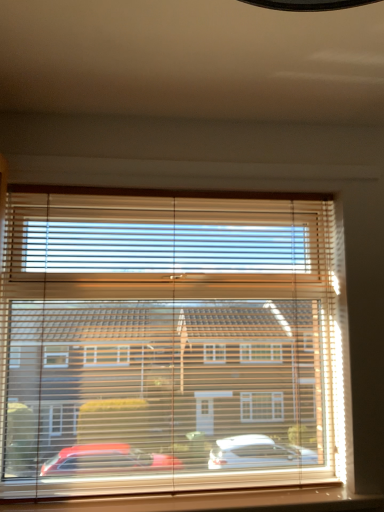
Question: From a real-world perspective, does wooden at lower center stand above wooden blinds at center?

Choices:
 (A) no
 (B) yes

Answer: (A)

Question: Is wooden at lower center oriented away from wooden blinds at center?

Choices:
 (A) yes
 (B) no

Answer: (A)

Question: Considering the relative positions of wooden at lower center and wooden blinds at center in the image provided, is wooden at lower center behind wooden blinds at center?

Choices:
 (A) yes
 (B) no

Answer: (B)

Question: Considering the relative sizes of wooden at lower center and wooden blinds at center in the image provided, is wooden at lower center taller than wooden blinds at center?

Choices:
 (A) no
 (B) yes

Answer: (A)

Question: Considering the relative sizes of wooden at lower center and wooden blinds at center in the image provided, is wooden at lower center wider than wooden blinds at center?

Choices:
 (A) no
 (B) yes

Answer: (B)

Question: From the image's perspective, is wooden at lower center below wooden blinds at center?

Choices:
 (A) yes
 (B) no

Answer: (A)

Question: Are wooden blinds at center and wooden at lower center making contact?

Choices:
 (A) yes
 (B) no

Answer: (B)

Question: Considering the relative sizes of wooden blinds at center and wooden at lower center in the image provided, is wooden blinds at center wider than wooden at lower center?

Choices:
 (A) yes
 (B) no

Answer: (B)

Question: Is wooden blinds at center positioned far away from wooden at lower center?

Choices:
 (A) no
 (B) yes

Answer: (A)

Question: Can we say wooden blinds at center lies outside wooden at lower center?

Choices:
 (A) yes
 (B) no

Answer: (A)

Question: Is wooden blinds at center taller than wooden at lower center?

Choices:
 (A) yes
 (B) no

Answer: (A)

Question: Considering the relative sizes of wooden blinds at center and wooden at lower center in the image provided, is wooden blinds at center shorter than wooden at lower center?

Choices:
 (A) no
 (B) yes

Answer: (A)

Question: From the image's perspective, relative to wooden blinds at center, is wooden at lower center above or below?

Choices:
 (A) below
 (B) above

Answer: (A)